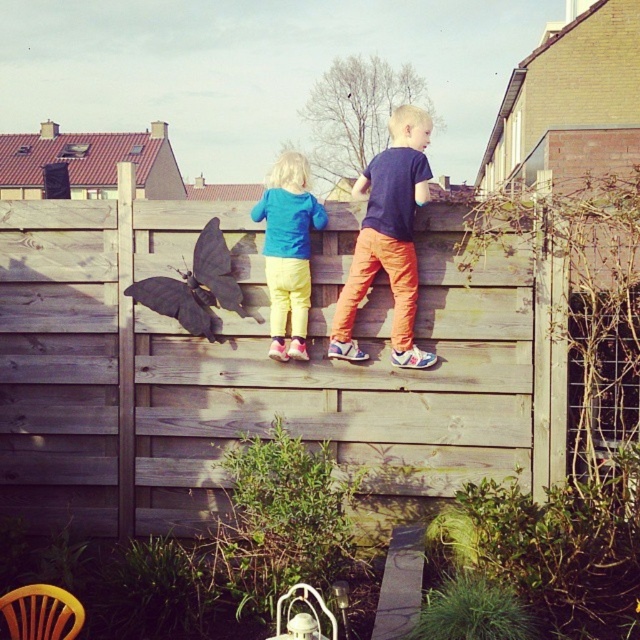
Question: Is wooden fence at center thinner than orange cotton pants at center?

Choices:
 (A) no
 (B) yes

Answer: (A)

Question: Estimate the real-world distances between objects in this image. Which object is closer to the wooden fence at center?

Choices:
 (A) orange cotton pants at center
 (B) matte blue hoodie at upper center

Answer: (B)

Question: Which of these objects is positioned farthest from the wooden fence at center?

Choices:
 (A) matte blue hoodie at upper center
 (B) orange cotton pants at center

Answer: (B)

Question: Which point is farther to the camera?

Choices:
 (A) (372, 172)
 (B) (278, 186)

Answer: (B)

Question: Can you confirm if orange cotton pants at center is thinner than matte blue hoodie at upper center?

Choices:
 (A) yes
 (B) no

Answer: (B)

Question: Considering the relative positions of wooden fence at center and orange cotton pants at center in the image provided, where is wooden fence at center located with respect to orange cotton pants at center?

Choices:
 (A) below
 (B) above

Answer: (A)